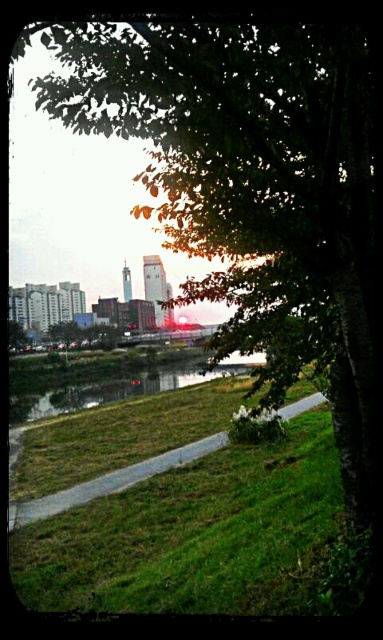
You are a landscape architect planning to install a small garden between the green grass at lower left and the green leafy tree at lower left. Given that the garden requires a minimum of 50 meters of space between them, will there be enough space?

The distance between the green grass at lower left and the green leafy tree at lower left is 45.47 meters, which is less than the required 50 meters. Therefore, there is not enough space for the garden.